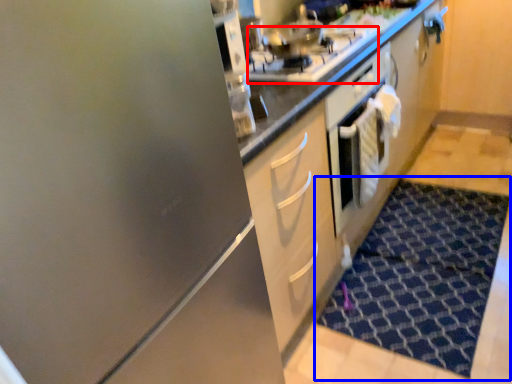
Question: Among these objects, which one is nearest to the camera, gas stove (highlighted by a red box) or doormat (highlighted by a blue box)?

Choices:
 (A) gas stove
 (B) doormat

Answer: (A)